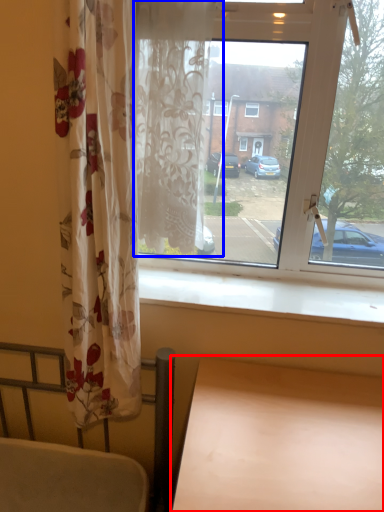
Question: Which object appears closest to the camera in this image, table (highlighted by a red box) or curtain (highlighted by a blue box)?

Choices:
 (A) table
 (B) curtain

Answer: (A)